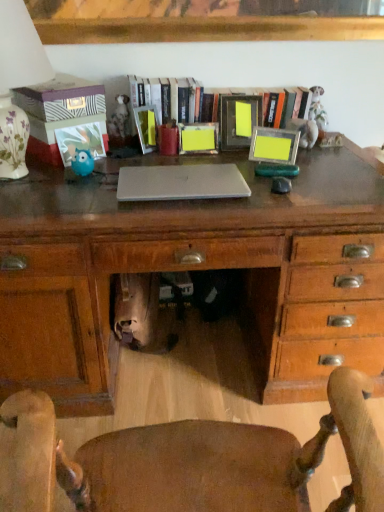
This screenshot has height=512, width=384. In order to click on vacant space to the right of matte plastic picture frame at upper center, positioned as the fourth picture frame in right-to-left order in this screenshot , I will do `click(191, 157)`.